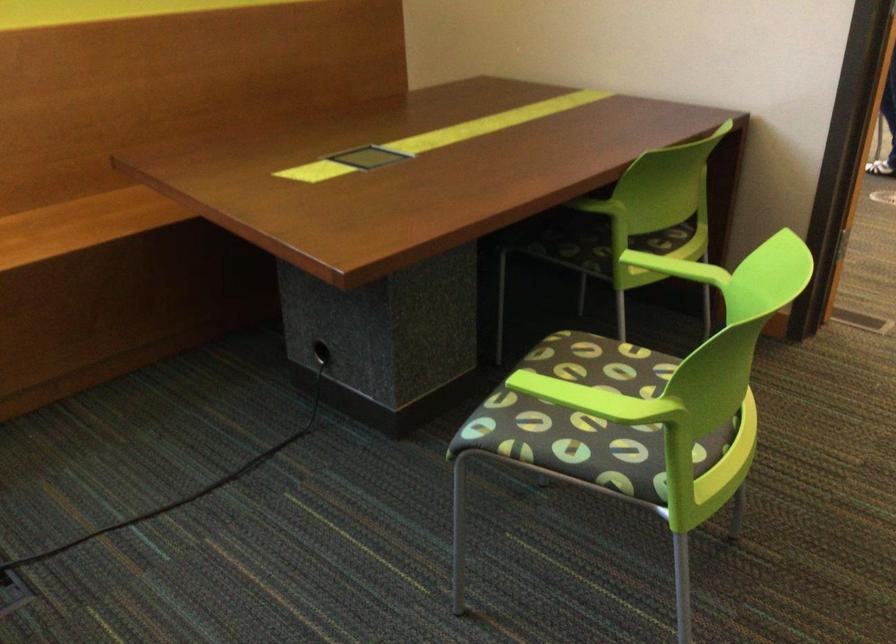
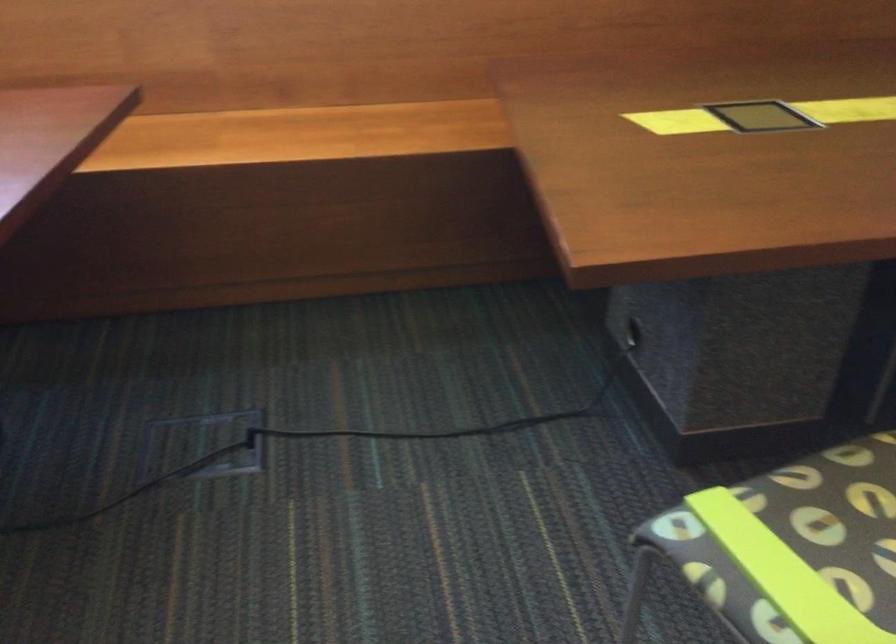
Locate, in the second image, the point that corresponds to [579,370] in the first image.

(871, 496)